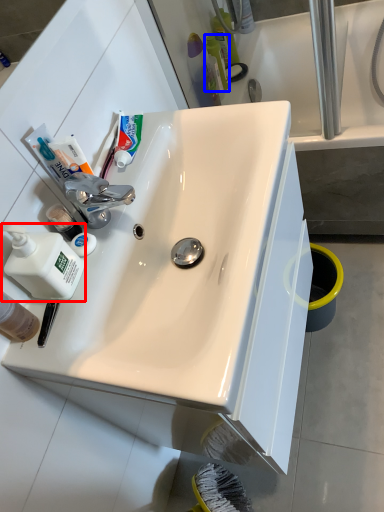
Question: Which point is closer to the camera, cleaning product (highlighted by a red box) or toiletry (highlighted by a blue box)?

Choices:
 (A) cleaning product
 (B) toiletry

Answer: (A)